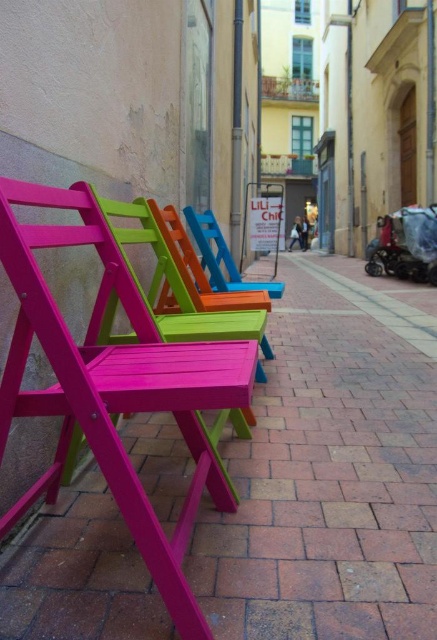
From the picture: You are a painter standing in the alleyway and want to paint the matte wood chairs at left and the matte blue wood chair at center. Which chair should you paint first if you want to start with the one closer to the ground?

The matte wood chairs at left should be painted first because they are positioned under the matte blue wood chair at center, meaning they are closer to the ground.